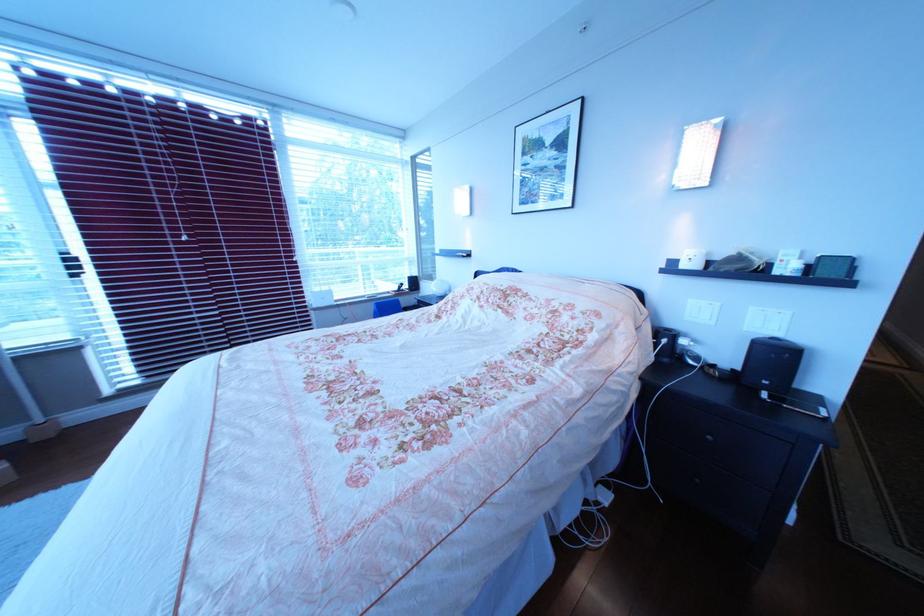
Where is `drawer handle`? The image size is (924, 616). drawer handle is located at coordinates (711, 438).